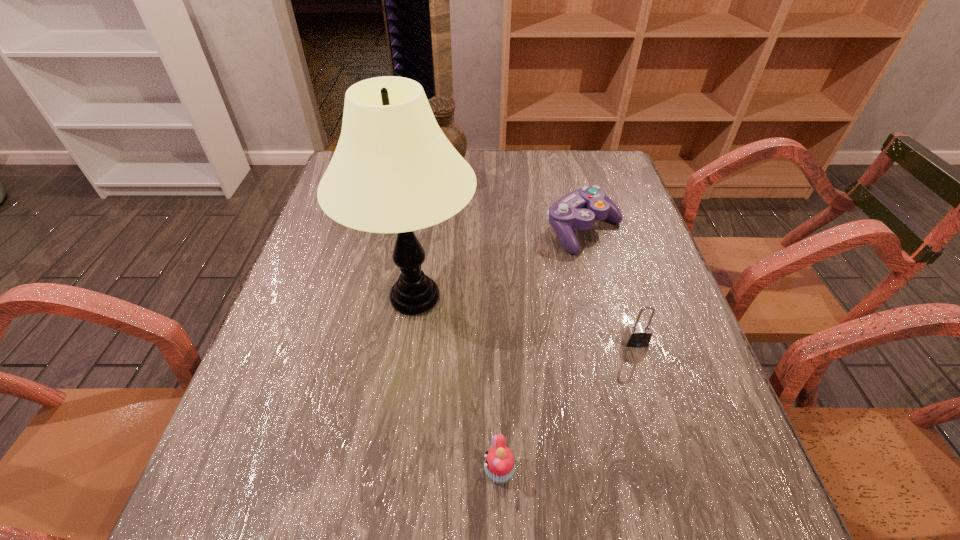
The width and height of the screenshot is (960, 540). In order to click on vacant point at the left edge in this screenshot , I will do (266, 361).

What are the coordinates of `vacant area at the right edge of the desktop` in the screenshot? It's located at (655, 484).

Locate an element on the screen. vacant space at the near left corner of the desktop is located at coordinates (292, 521).

In the image, there is a desktop. Where is `blank space at the far right corner`? blank space at the far right corner is located at coordinates (613, 190).

Find the location of a particular element. The height and width of the screenshot is (540, 960). vacant space at the near right corner is located at coordinates [x=703, y=516].

This screenshot has height=540, width=960. In order to click on blank region between the shortest object and the tallest object in this screenshot , I will do `click(457, 384)`.

Locate an element on the screen. The width and height of the screenshot is (960, 540). unoccupied position between the padlock and the lamp is located at coordinates pos(525,320).

The height and width of the screenshot is (540, 960). Find the location of `empty space between the farthest object and the cupcake`. empty space between the farthest object and the cupcake is located at coordinates (470, 323).

I want to click on vacant region between the padlock and the cupcake, so click(x=567, y=407).

Identify the location of free area in between the third object from left to right and the control. (541, 351).